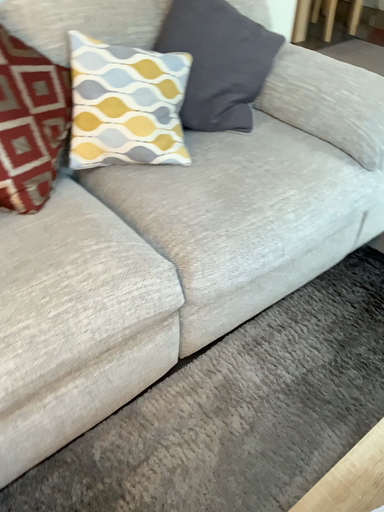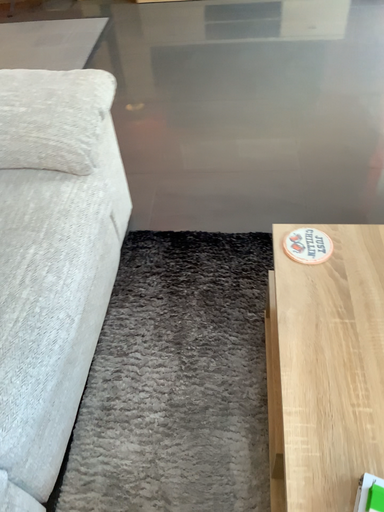
Question: Which way did the camera rotate in the video?

Choices:
 (A) rotated upward
 (B) rotated downward

Answer: (A)